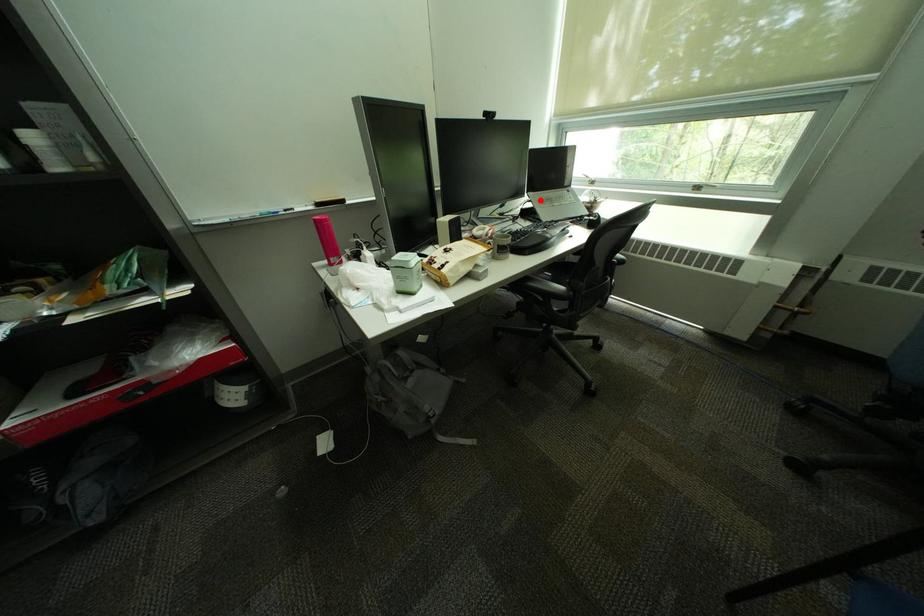
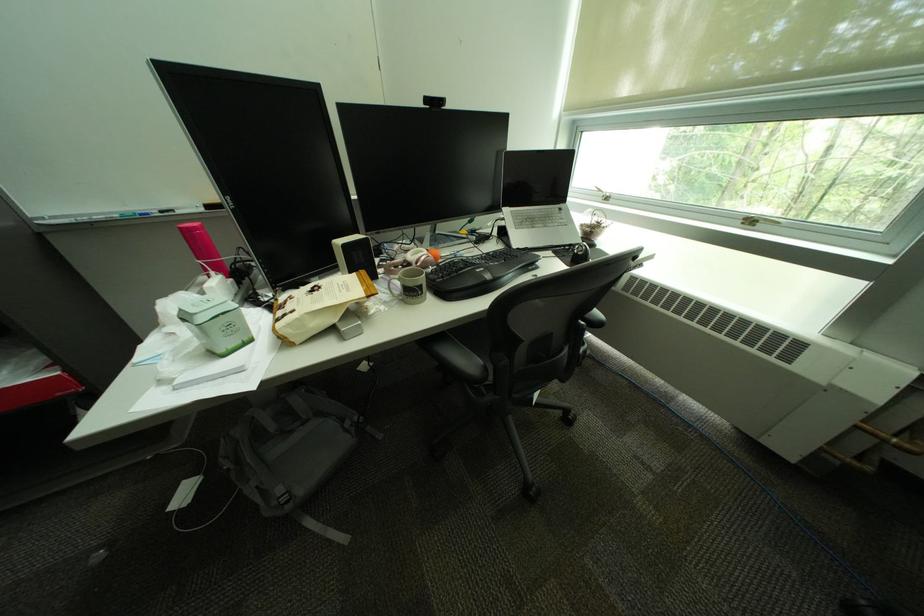
Where in the second image is the point corresponding to the highlighted location from the first image?

(514, 217)